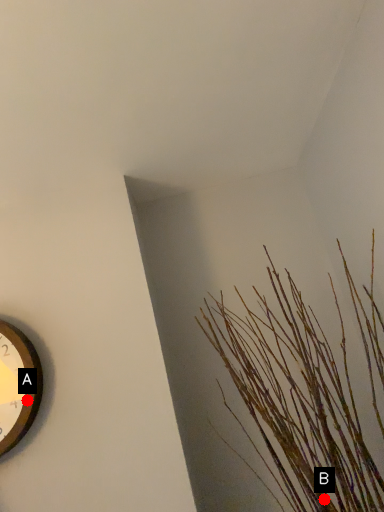
Question: Two points are circled on the image, labeled by A and B beside each circle. Which point appears closest to the camera in this image?

Choices:
 (A) A is closer
 (B) B is closer

Answer: (B)